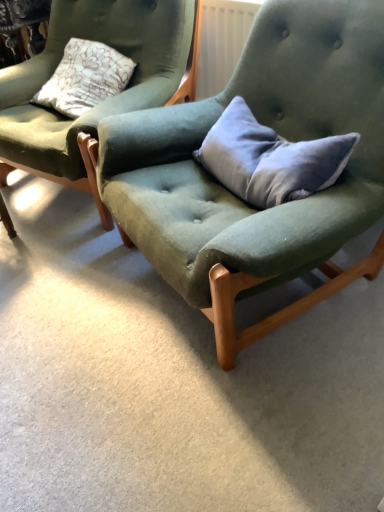
Question: From a real-world perspective, is gray velvet pillow at center under velvet green chair at center, which is counted as the 1th chair, starting from the left?

Choices:
 (A) yes
 (B) no

Answer: (B)

Question: From the image's perspective, is gray velvet pillow at center beneath velvet green chair at center, marked as the 2th chair in a right-to-left arrangement?

Choices:
 (A) yes
 (B) no

Answer: (A)

Question: Considering the relative sizes of gray velvet pillow at center and velvet green chair at center, which is counted as the 1th chair, starting from the left, in the image provided, is gray velvet pillow at center shorter than velvet green chair at center, which is counted as the 1th chair, starting from the left,?

Choices:
 (A) yes
 (B) no

Answer: (A)

Question: Is the depth of gray velvet pillow at center less than that of velvet green chair at center, which is counted as the 1th chair, starting from the left?

Choices:
 (A) no
 (B) yes

Answer: (B)

Question: Does gray velvet pillow at center have a larger size compared to velvet green chair at center, marked as the 2th chair in a right-to-left arrangement?

Choices:
 (A) yes
 (B) no

Answer: (B)

Question: Is gray velvet pillow at center to the left of velvet green chair at center, which is counted as the 1th chair, starting from the left, from the viewer's perspective?

Choices:
 (A) yes
 (B) no

Answer: (B)

Question: Is velvet green chair at center, marked as the 2th chair in a right-to-left arrangement, shorter than velvet green chair at center, placed as the 1th chair when sorted from right to left?

Choices:
 (A) no
 (B) yes

Answer: (B)

Question: Does velvet green chair at center, which is counted as the 1th chair, starting from the left, have a lesser width compared to velvet green chair at center, the second chair from the left?

Choices:
 (A) no
 (B) yes

Answer: (B)

Question: From the image's perspective, is velvet green chair at center, which is counted as the 1th chair, starting from the left, above velvet green chair at center, placed as the 1th chair when sorted from right to left?

Choices:
 (A) no
 (B) yes

Answer: (B)

Question: Does velvet green chair at center, marked as the 2th chair in a right-to-left arrangement, lie in front of velvet green chair at center, the second chair from the left?

Choices:
 (A) yes
 (B) no

Answer: (B)

Question: Could you tell me if velvet green chair at center, which is counted as the 1th chair, starting from the left, is facing velvet green chair at center, placed as the 1th chair when sorted from right to left?

Choices:
 (A) no
 (B) yes

Answer: (A)

Question: From the image's perspective, is velvet green chair at center, marked as the 2th chair in a right-to-left arrangement, beneath velvet green chair at center, the second chair from the left?

Choices:
 (A) no
 (B) yes

Answer: (A)

Question: Is gray velvet pillow at center oriented towards velvet green chair at center, placed as the 1th chair when sorted from right to left?

Choices:
 (A) yes
 (B) no

Answer: (A)